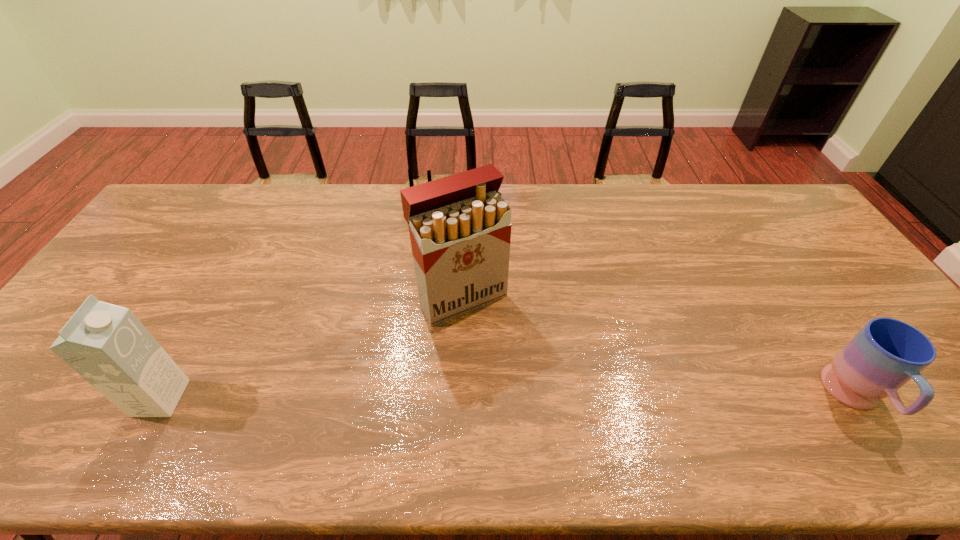
Locate an element on the screen. This screenshot has width=960, height=540. carton is located at coordinates (106, 344).

Locate an element on the screen. The image size is (960, 540). the leftmost object is located at coordinates (106, 344).

Find the location of a particular element. The image size is (960, 540). mug is located at coordinates (886, 353).

At what (x,y) coordinates should I click in order to perform the action: click on router. Please return your answer as a coordinate pair (x, y). This screenshot has width=960, height=540. Looking at the image, I should click on (410, 176).

At what (x,y) coordinates should I click in order to perform the action: click on the tallest object. Please return your answer as a coordinate pair (x, y). This screenshot has height=540, width=960. Looking at the image, I should click on (460, 227).

Find the location of a particular element. This screenshot has height=540, width=960. cigarette case is located at coordinates (460, 227).

I want to click on free space located 0.090m on the front label of the carton, so click(x=220, y=398).

Identify the location of free space located 0.220m on the back of the router. (439, 279).

Identify the location of vacant position located on the back of the router. The width and height of the screenshot is (960, 540). (427, 321).

The image size is (960, 540). I want to click on vacant space located on the back of the router, so click(444, 253).